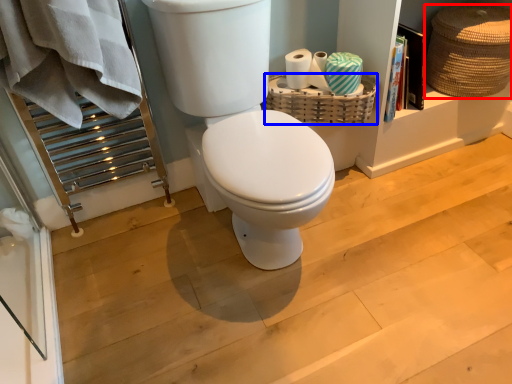
Question: Which point is further to the camera, basket (highlighted by a red box) or basket (highlighted by a blue box)?

Choices:
 (A) basket
 (B) basket

Answer: (B)